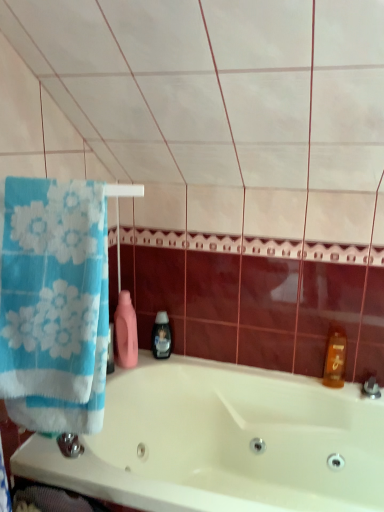
Locate an element on the screen. vacant space situated on the left part of black plastic soap dispenser at center is located at coordinates (137, 362).